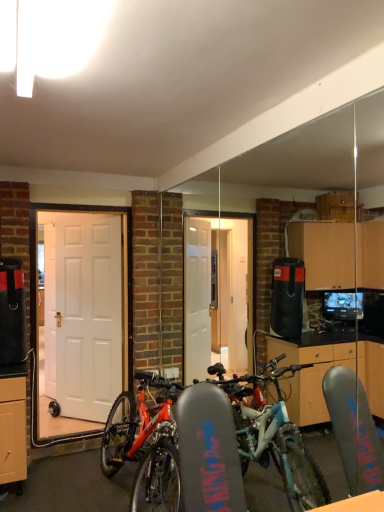
Question: In which direction should I rotate to look at white glossy door at center, the second door from the left?

Choices:
 (A) right
 (B) left

Answer: (B)

Question: Is white glossy door at center, the 2th door viewed from the back, to the left of white matte door at left, arranged as the 1th door when viewed from the back, from the viewer's perspective?

Choices:
 (A) no
 (B) yes

Answer: (A)

Question: Could white matte door at left, marked as the 2th door in a front-to-back arrangement, be considered to be inside white glossy door at center, marked as the 1th door in a front-to-back arrangement?

Choices:
 (A) yes
 (B) no

Answer: (B)

Question: Can we say white glossy door at center, marked as the 1th door in a front-to-back arrangement, lies outside white matte door at left, arranged as the 1th door when viewed from the back?

Choices:
 (A) no
 (B) yes

Answer: (B)

Question: Can you confirm if white glossy door at center, the 2th door viewed from the back, is taller than white matte door at left, the 1th door from the left?

Choices:
 (A) no
 (B) yes

Answer: (B)

Question: Does white glossy door at center, the second door from the left, have a larger size compared to white matte door at left, arranged as the 1th door when viewed from the back?

Choices:
 (A) yes
 (B) no

Answer: (A)

Question: Does white glossy door at center, marked as the 1th door in a front-to-back arrangement, have a greater width compared to white matte door at left, marked as the 2th door in a front-to-back arrangement?

Choices:
 (A) no
 (B) yes

Answer: (B)

Question: Can white glossy door at center, which ranks as the first door in right-to-left order, be found inside white matte door at left, the 1th door from the left?

Choices:
 (A) yes
 (B) no

Answer: (B)

Question: Is white matte door at left, marked as the 2th door in a front-to-back arrangement, in front of white glossy door at center, which ranks as the first door in right-to-left order?

Choices:
 (A) yes
 (B) no

Answer: (B)

Question: From a real-world perspective, is white matte door at left, the second door positioned from the right, on top of white glossy door at center, the 2th door viewed from the back?

Choices:
 (A) yes
 (B) no

Answer: (B)

Question: Considering the relative positions of white matte door at left, arranged as the 1th door when viewed from the back, and white glossy door at center, the second door from the left, in the image provided, is white matte door at left, arranged as the 1th door when viewed from the back, to the left of white glossy door at center, the second door from the left, from the viewer's perspective?

Choices:
 (A) yes
 (B) no

Answer: (A)

Question: Is white matte door at left, arranged as the 1th door when viewed from the back, bigger than white glossy door at center, the 2th door viewed from the back?

Choices:
 (A) yes
 (B) no

Answer: (B)

Question: From the image's perspective, is white matte door at left, arranged as the 1th door when viewed from the back, located beneath white glossy door at center, which ranks as the first door in right-to-left order?

Choices:
 (A) no
 (B) yes

Answer: (B)

Question: Considering the relative positions of white glossy door at center, the second door from the left, and white matte door at left, marked as the 2th door in a front-to-back arrangement, in the image provided, is white glossy door at center, the second door from the left, to the left or to the right of white matte door at left, marked as the 2th door in a front-to-back arrangement,?

Choices:
 (A) right
 (B) left

Answer: (A)